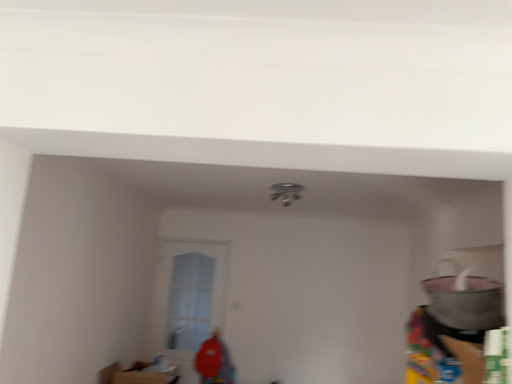
Question: Is clear glass door at center completely or partially inside matte gray pot at right?

Choices:
 (A) no
 (B) yes

Answer: (A)

Question: Considering the relative sizes of matte gray pot at right and clear glass door at center in the image provided, is matte gray pot at right bigger than clear glass door at center?

Choices:
 (A) no
 (B) yes

Answer: (B)

Question: Is the depth of matte gray pot at right less than that of clear glass door at center?

Choices:
 (A) yes
 (B) no

Answer: (A)

Question: From a real-world perspective, is matte gray pot at right located higher than clear glass door at center?

Choices:
 (A) yes
 (B) no

Answer: (A)

Question: Is matte gray pot at right to the right of clear glass door at center from the viewer's perspective?

Choices:
 (A) yes
 (B) no

Answer: (A)

Question: Is the depth of matte gray pot at right greater than that of clear glass door at center?

Choices:
 (A) yes
 (B) no

Answer: (B)

Question: Considering the relative positions of clear glass door at center and matte gray pot at right in the image provided, is clear glass door at center behind matte gray pot at right?

Choices:
 (A) no
 (B) yes

Answer: (B)

Question: Is clear glass door at center at the right side of matte gray pot at right?

Choices:
 (A) yes
 (B) no

Answer: (B)

Question: Is the position of clear glass door at center less distant than that of matte gray pot at right?

Choices:
 (A) no
 (B) yes

Answer: (A)

Question: From the image's perspective, is clear glass door at center below matte gray pot at right?

Choices:
 (A) no
 (B) yes

Answer: (B)

Question: Is clear glass door at center taller than matte gray pot at right?

Choices:
 (A) no
 (B) yes

Answer: (B)

Question: From a real-world perspective, is clear glass door at center on matte gray pot at right?

Choices:
 (A) yes
 (B) no

Answer: (B)

Question: From the image's perspective, is clear glass door at center above or below matte gray pot at right?

Choices:
 (A) below
 (B) above

Answer: (A)